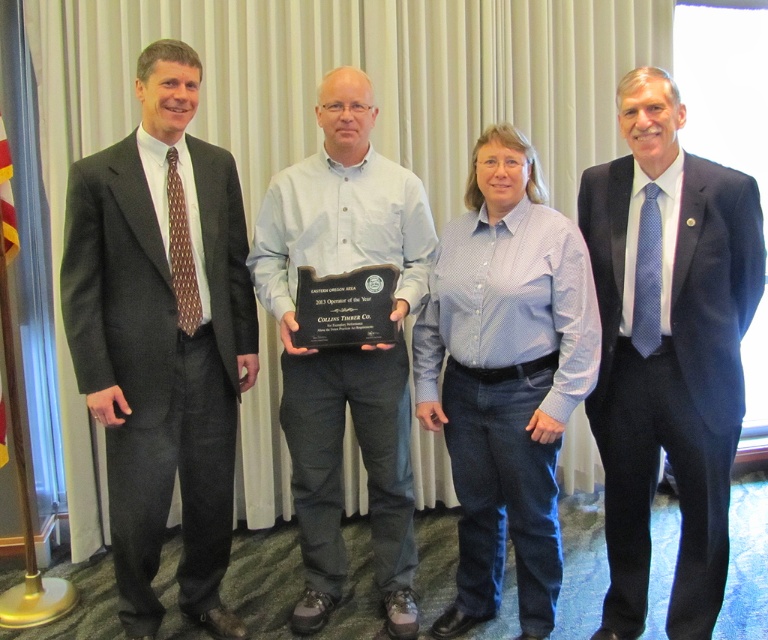
Question: Which object is the closest to the light blue shirt at center?

Choices:
 (A) dark gray suit at left
 (B) blue cotton shirt at center
 (C) dark blue suit at right

Answer: (B)

Question: Based on their relative distances, which object is nearer to the blue cotton shirt at center?

Choices:
 (A) dark gray suit at left
 (B) dark blue suit at right

Answer: (B)

Question: Which point is closer to the camera taking this photo?

Choices:
 (A) (189, 104)
 (B) (323, 120)
 (C) (554, 291)
 (D) (631, 168)

Answer: (C)

Question: Is the position of dark blue suit at right less distant than that of light blue shirt at center?

Choices:
 (A) no
 (B) yes

Answer: (B)

Question: Is blue cotton shirt at center smaller than light blue shirt at center?

Choices:
 (A) no
 (B) yes

Answer: (B)

Question: Can you confirm if dark gray suit at left is positioned to the left of dark blue suit at right?

Choices:
 (A) no
 (B) yes

Answer: (B)